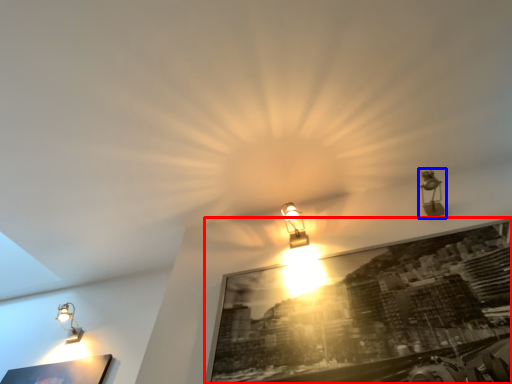
Question: Which of the following is the farthest to the observer, picture frame (highlighted by a red box) or lamp (highlighted by a blue box)?

Choices:
 (A) picture frame
 (B) lamp

Answer: (B)